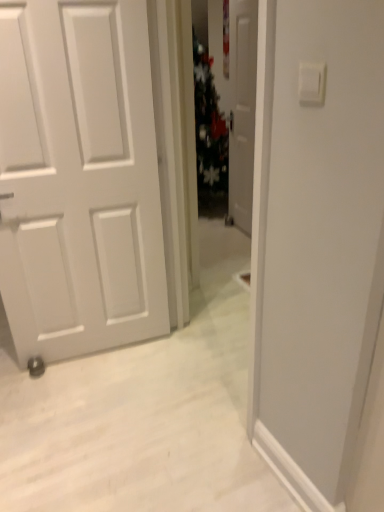
The image size is (384, 512). What do you see at coordinates (242, 109) in the screenshot?
I see `white glossy door at center` at bounding box center [242, 109].

Locate an element on the screen. white glossy door at center is located at coordinates (242, 109).

Image resolution: width=384 pixels, height=512 pixels. Describe the element at coordinates (311, 83) in the screenshot. I see `white plastic light switch at upper right` at that location.

Locate an element on the screen. white plastic light switch at upper right is located at coordinates (311, 83).

At what (x,y) coordinates should I click in order to perform the action: click on white glossy door at center. Please return your answer as a coordinate pair (x, y). Looking at the image, I should click on (242, 109).

Which is more to the right, white glossy door at center or white plastic light switch at upper right?

white glossy door at center is more to the right.

Does white glossy door at center lie behind white plastic light switch at upper right?

Yes, white glossy door at center is further from the camera.

Between point (244, 133) and point (319, 81), which one is positioned behind?

The point (244, 133) is farther from the camera.

From the image's perspective, does white glossy door at center appear higher than white plastic light switch at upper right?

Correct, white glossy door at center appears higher than white plastic light switch at upper right in the image.

From a real-world perspective, which is physically above, white glossy door at center or white plastic light switch at upper right?

white plastic light switch at upper right.

Is white glossy door at center wider or thinner than white plastic light switch at upper right?

In the image, white glossy door at center appears to be wider than white plastic light switch at upper right.

In the scene shown: Which of these two, white glossy door at center or white plastic light switch at upper right, stands shorter?

white plastic light switch at upper right is shorter.

Does white glossy door at center have a larger size compared to white plastic light switch at upper right?

Correct, white glossy door at center is larger in size than white plastic light switch at upper right.

From the picture: Is white plastic light switch at upper right located within white glossy door at center?

That's incorrect, white plastic light switch at upper right is not inside white glossy door at center.

Is white glossy door at center in contact with white plastic light switch at upper right?

They are not placed beside each other.

Could you tell me if white glossy door at center is facing white plastic light switch at upper right?

No.

How many degrees apart are the facing directions of white glossy door at center and white plastic light switch at upper right?

white glossy door at center and white plastic light switch at upper right are facing 7.32 degrees away from each other.

Identify the location of door behind the white plastic light switch at upper right. The image size is (384, 512). (242, 109).

Considering the relative positions of white plastic light switch at upper right and white glossy door at center in the image provided, is white plastic light switch at upper right to the left or to the right of white glossy door at center?

Based on their positions, white plastic light switch at upper right is located to the left of white glossy door at center.

Which object is more forward, white plastic light switch at upper right or white glossy door at center?

white plastic light switch at upper right is more forward.

Which point is more distant from viewer, (320, 82) or (252, 162)?

The point (252, 162) is behind.

From the image's perspective, relative to white glossy door at center, is white plastic light switch at upper right above or below?

Clearly, from the image's perspective, white plastic light switch at upper right is below white glossy door at center.

Consider the image. From a real-world perspective, is white plastic light switch at upper right physically located above or below white glossy door at center?

white plastic light switch at upper right is above white glossy door at center.

Does white plastic light switch at upper right have a greater width compared to white glossy door at center?

Incorrect, the width of white plastic light switch at upper right does not surpass that of white glossy door at center.

Considering the sizes of white plastic light switch at upper right and white glossy door at center in the image, is white plastic light switch at upper right taller or shorter than white glossy door at center?

Considering their sizes, white plastic light switch at upper right has less height than white glossy door at center.

Based on their sizes in the image, would you say white plastic light switch at upper right is bigger or smaller than white glossy door at center?

Clearly, white plastic light switch at upper right is smaller in size than white glossy door at center.

Which is correct: white plastic light switch at upper right is inside white glossy door at center, or outside of it?

white plastic light switch at upper right is spatially situated outside white glossy door at center.

Can you see white plastic light switch at upper right touching white glossy door at center?

white plastic light switch at upper right and white glossy door at center are clearly separated.

Is white plastic light switch at upper right positioned with its back to white glossy door at center?

white plastic light switch at upper right is not turned away from white glossy door at center.

How different are the orientations of white plastic light switch at upper right and white glossy door at center in degrees?

white plastic light switch at upper right and white glossy door at center are facing 7.32 degrees away from each other.

Identify the location of door that is behind the white plastic light switch at upper right. (242, 109).

This screenshot has width=384, height=512. In the image, there is a white plastic light switch at upper right. In order to click on door below it (from a real-world perspective) in this screenshot , I will do `click(242, 109)`.

Where is `light switch lying in front of the white glossy door at center`? This screenshot has height=512, width=384. light switch lying in front of the white glossy door at center is located at coordinates (311, 83).